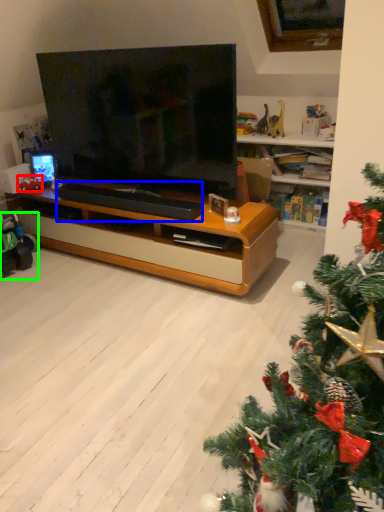
Question: Considering the real-world distances, which object is farthest from toy (highlighted by a red box)? footrest (highlighted by a blue box) or toy (highlighted by a green box)?

Choices:
 (A) footrest
 (B) toy

Answer: (A)